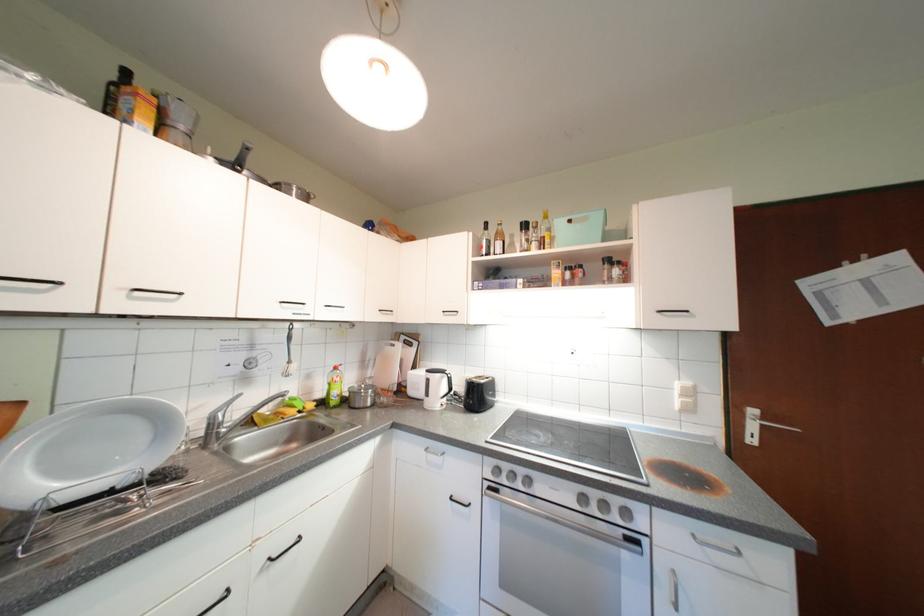
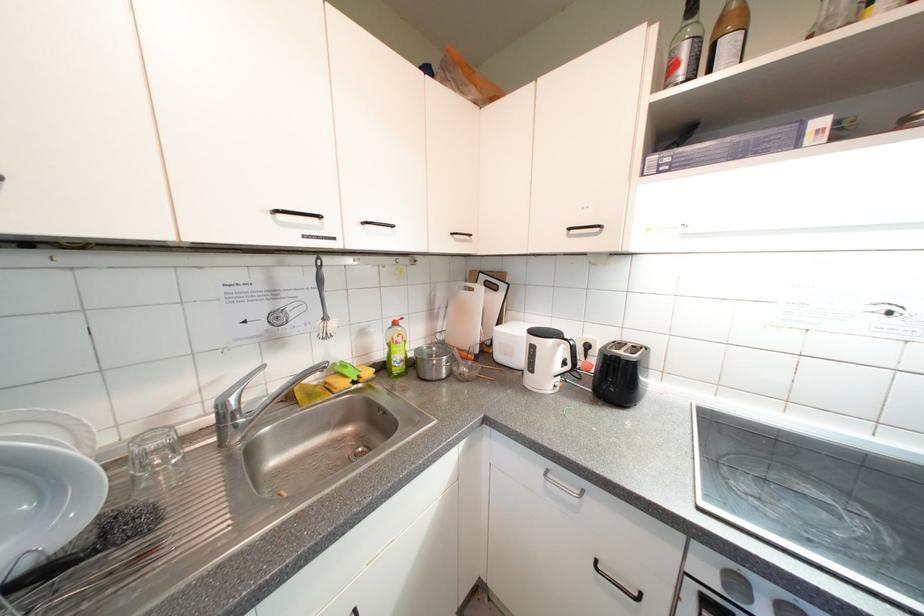
What movement of the cameraman would produce the second image?

The cameraman moved toward left, forward.